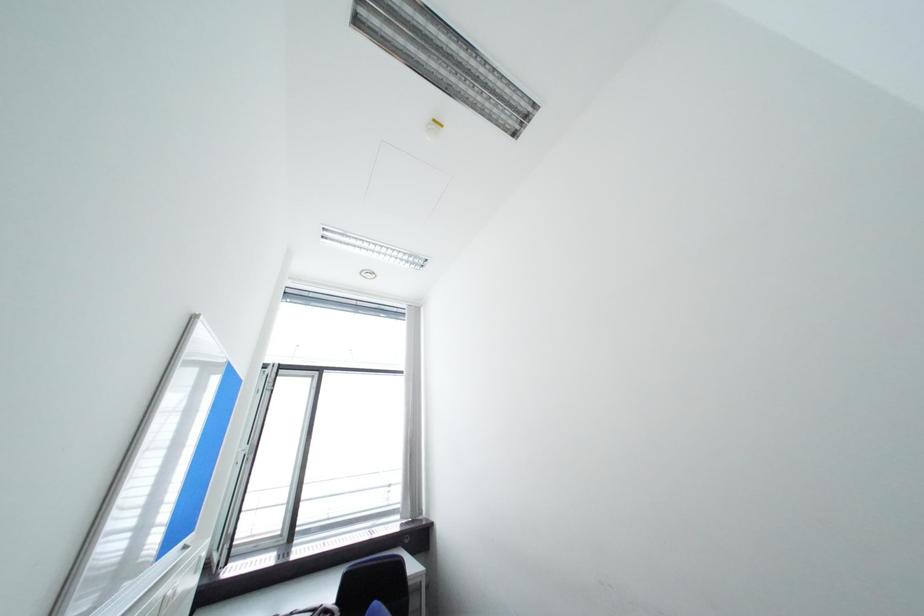
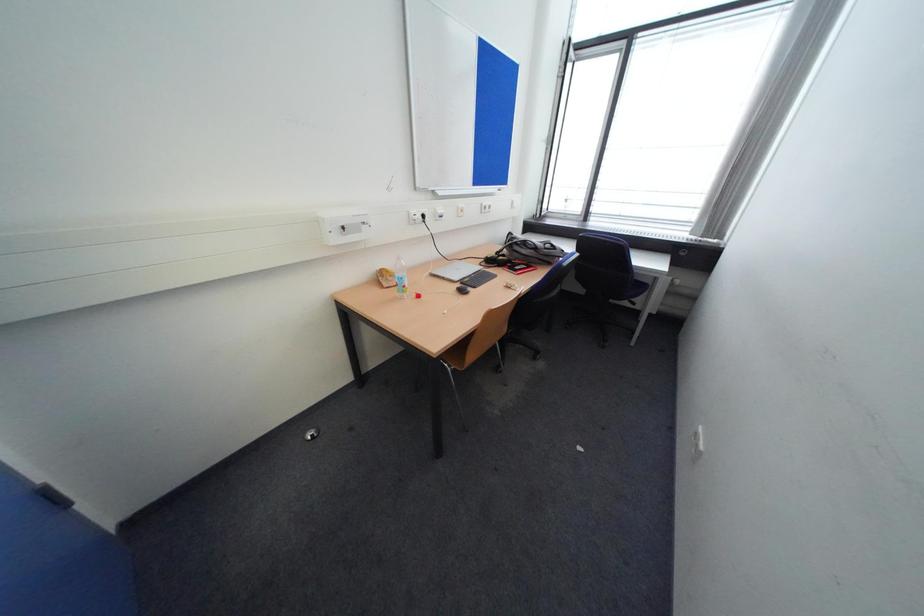
Based on the continuous images, in which direction is the camera rotating?

The camera rotated toward left-down.